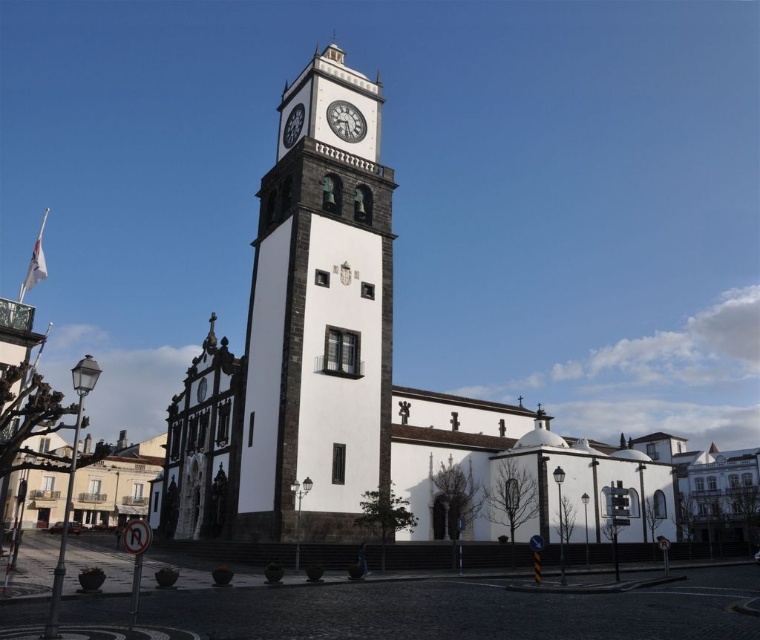
Question: Which point is farther to the camera?

Choices:
 (A) white stucco church at center
 (B) white stone clock at upper center
 (C) white stone clock tower at center
 (D) white matte clock at upper center

Answer: (D)

Question: Observing the image, what is the correct spatial positioning of white matte clock at upper center in reference to white stone clock at upper center?

Choices:
 (A) left
 (B) right

Answer: (B)

Question: Is white stucco church at center in front of white matte clock at upper center?

Choices:
 (A) yes
 (B) no

Answer: (A)

Question: Estimate the real-world distances between objects in this image. Which object is closer to the white stone clock tower at center?

Choices:
 (A) white stone clock at upper center
 (B) white matte clock at upper center
 (C) white stucco church at center

Answer: (C)

Question: Which of the following is the closest to the observer?

Choices:
 (A) white stucco church at center
 (B) white stone clock at upper center

Answer: (A)

Question: Is white stucco church at center behind white matte clock at upper center?

Choices:
 (A) yes
 (B) no

Answer: (B)